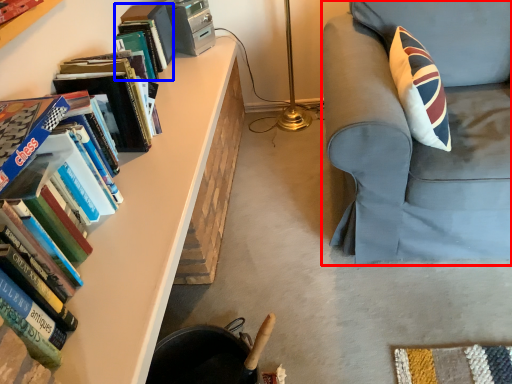
Question: Which of the following is the closest to the observer, chair (highlighted by a red box) or book (highlighted by a blue box)?

Choices:
 (A) chair
 (B) book

Answer: (A)